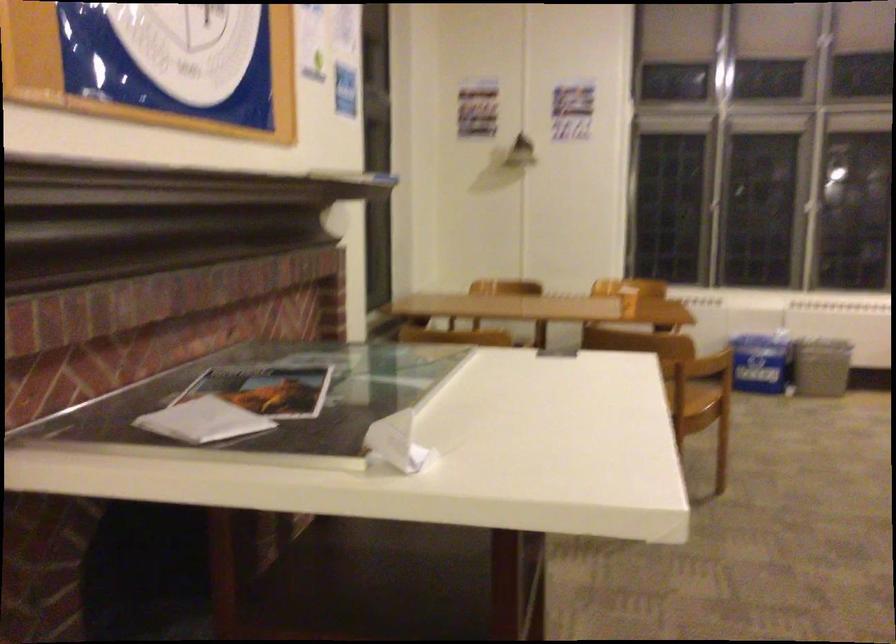
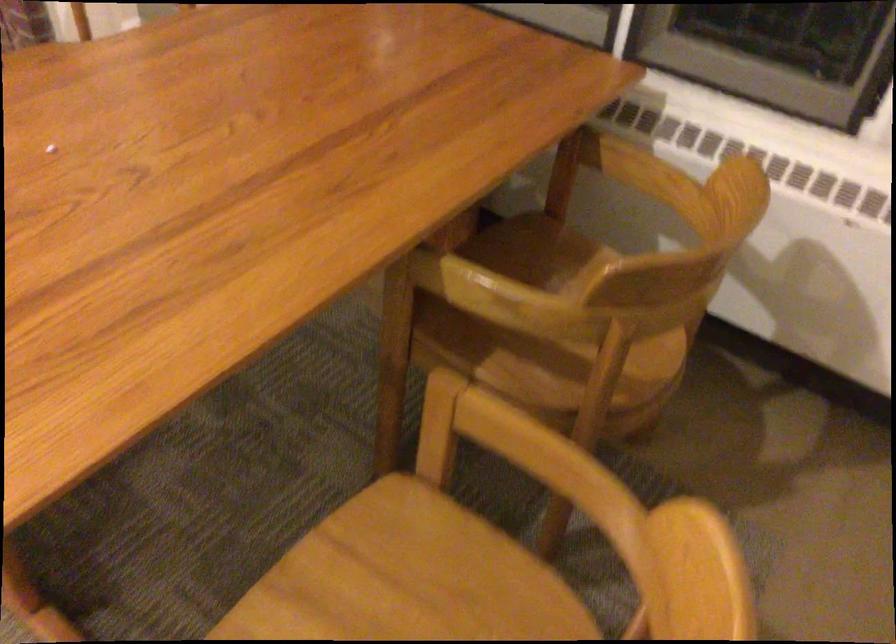
In the second image, find the point that corresponds to (520,292) in the first image.

(545, 330)